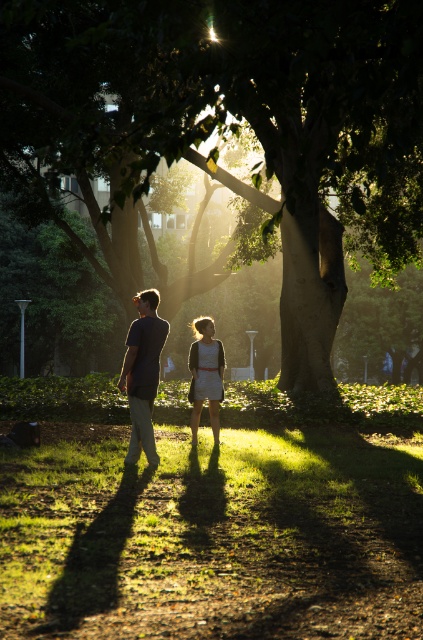
Question: Can you confirm if green leafy tree at center is positioned to the left of matte white dress at center?

Choices:
 (A) no
 (B) yes

Answer: (A)

Question: Which object is positioned closest to the matte white dress at center?

Choices:
 (A) green leafy tree at center
 (B) matte gray shirt at center

Answer: (B)

Question: Is green leafy tree at center thinner than matte white dress at center?

Choices:
 (A) yes
 (B) no

Answer: (B)

Question: Estimate the real-world distances between objects in this image. Which object is farther from the matte white dress at center?

Choices:
 (A) matte gray shirt at center
 (B) green leafy tree at center

Answer: (B)

Question: Which of the following is the farthest from the observer?

Choices:
 (A) matte white dress at center
 (B) matte gray shirt at center

Answer: (A)

Question: Is matte gray shirt at center smaller than matte white dress at center?

Choices:
 (A) no
 (B) yes

Answer: (A)